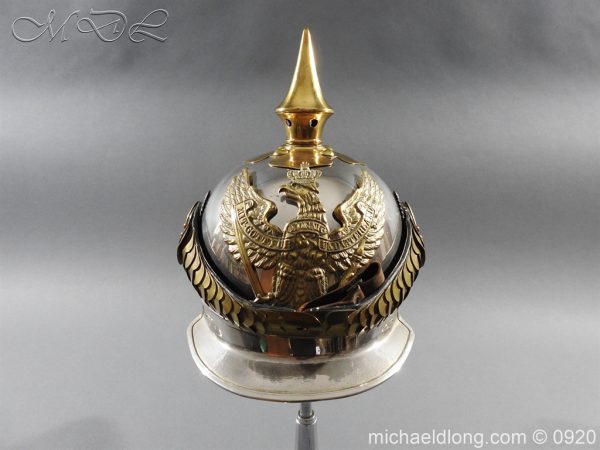
Where is `stainless steel display plate`? The height and width of the screenshot is (450, 600). stainless steel display plate is located at coordinates (301, 376).